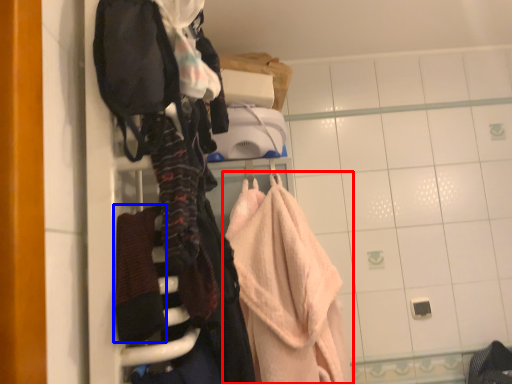
Question: Which object is further to the camera taking this photo, towel (highlighted by a red box) or bath towel (highlighted by a blue box)?

Choices:
 (A) towel
 (B) bath towel

Answer: (A)